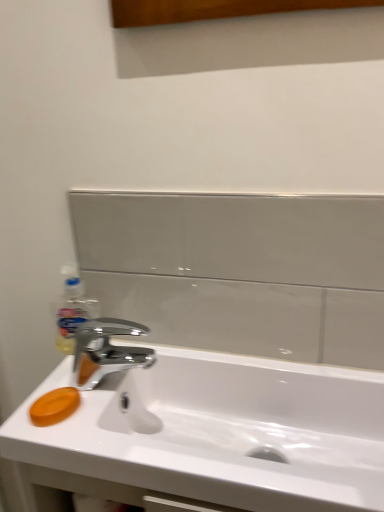
Find the location of a particular element. This screenshot has width=384, height=512. free space behind orange matte soap at lower left is located at coordinates (91, 369).